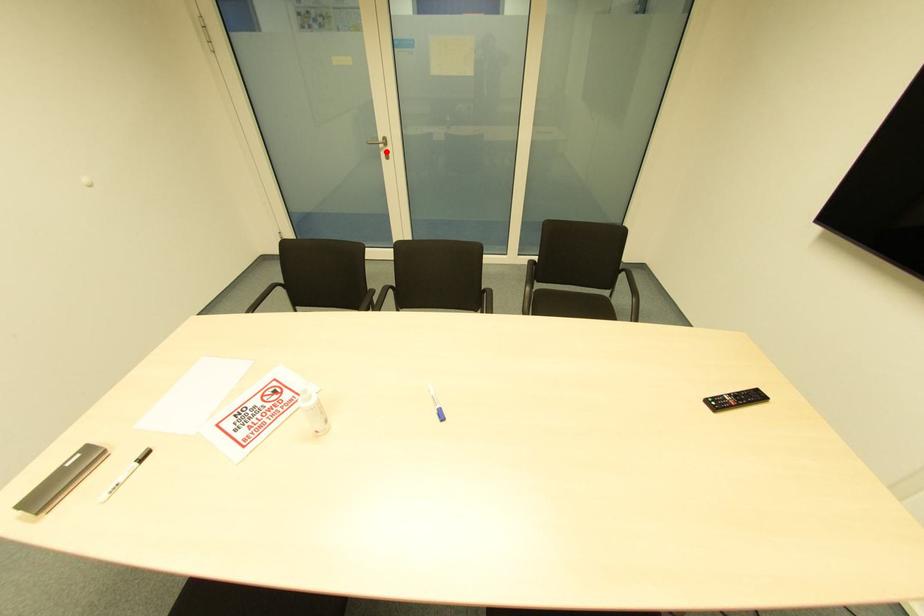
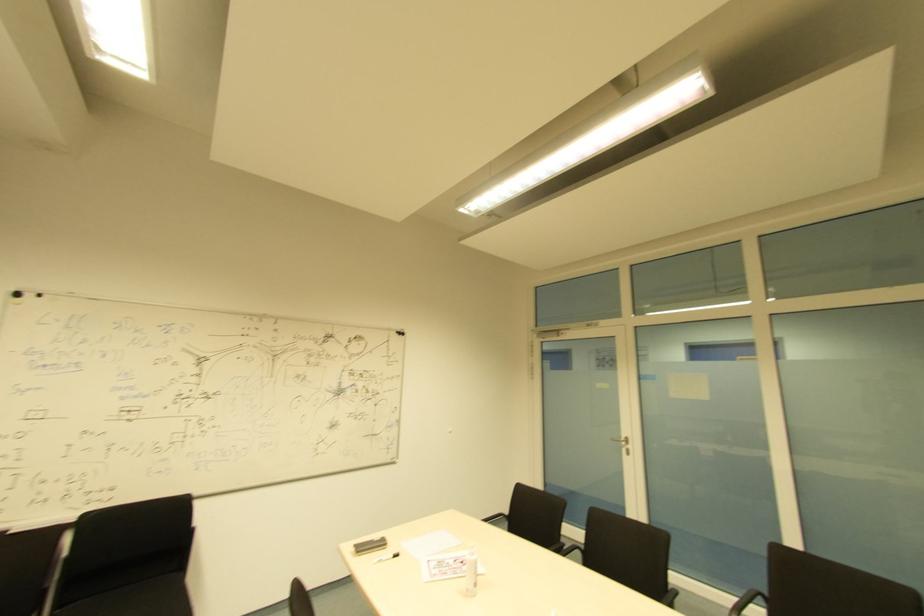
Where in the second image is the point corresponding to the highlighted location from the first image?

(628, 450)